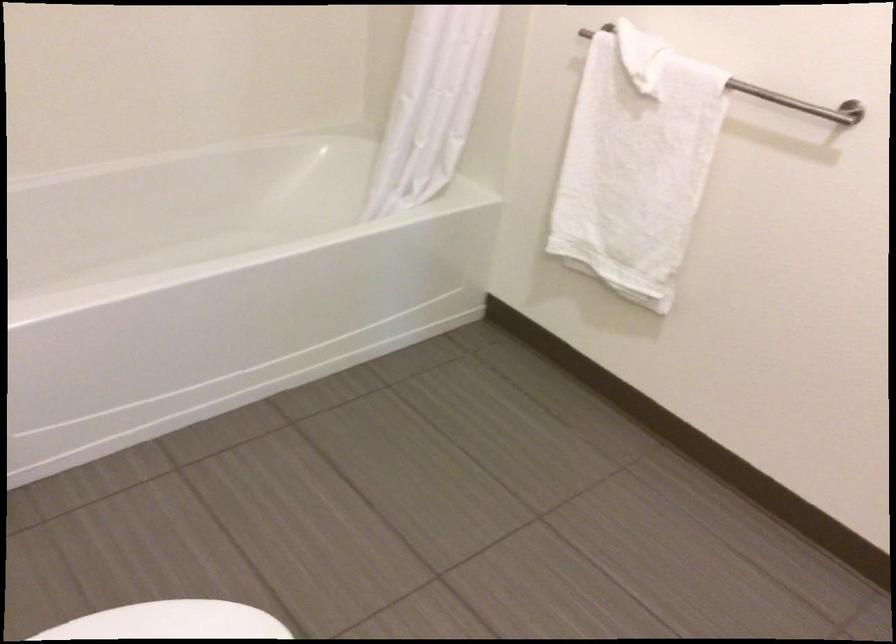
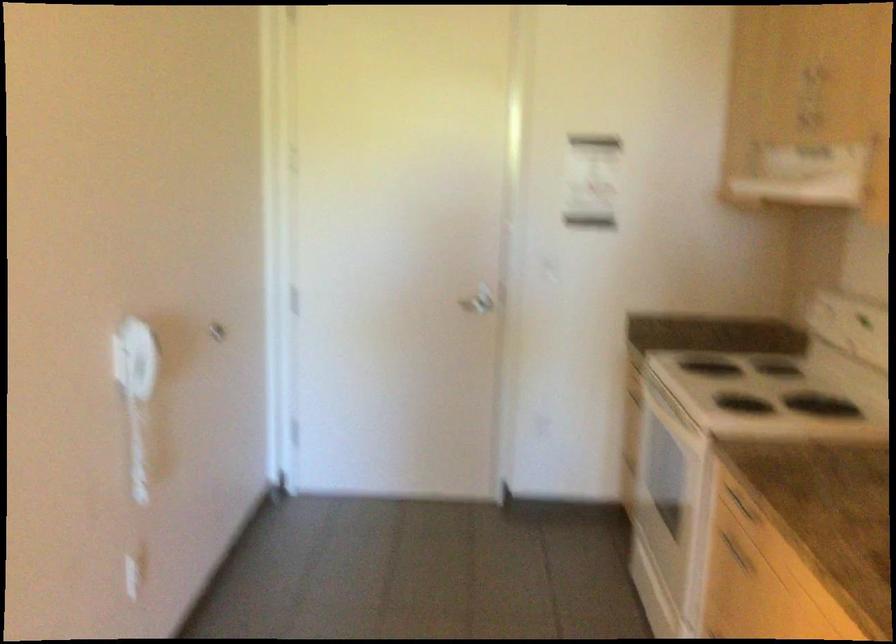
Question: I am providing you with two images of the same scene from different viewpoints. Which of the following objects are not visible in image2?

Choices:
 (A) silver door handle
 (B) white towel
 (C) small colorful book
 (D) drawer handle

Answer: (B)